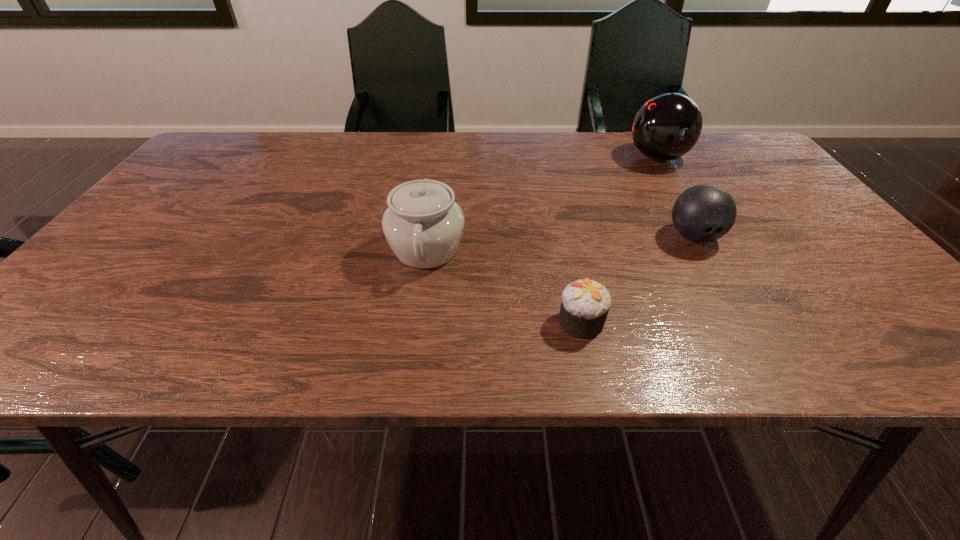
Image resolution: width=960 pixels, height=540 pixels. What are the coordinates of `vacant space in between the chinaware and the third object from right to left` in the screenshot? It's located at (504, 286).

This screenshot has width=960, height=540. What are the coordinates of `the second closest object relative to the chinaware` in the screenshot? It's located at (703, 213).

Identify which object is the second nearest to the third shortest object. Please provide its 2D coordinates. Your answer should be formatted as a tuple, i.e. [(x, y)], where the tuple contains the x and y coordinates of a point satisfying the conditions above.

[(703, 213)]

Where is `vacant space that satisfies the following two spatial constraints: 1. on the surface of the farther bowling ball near the finger holes; 2. on the grip area of the second shortest object`? vacant space that satisfies the following two spatial constraints: 1. on the surface of the farther bowling ball near the finger holes; 2. on the grip area of the second shortest object is located at coordinates (706, 237).

Identify the location of free point that satisfies the following two spatial constraints: 1. on the surface of the farther bowling ball near the finger holes; 2. on the grip area of the nearer bowling ball. (706, 237).

Where is `vacant point that satisfies the following two spatial constraints: 1. on the surface of the taller bowling ball near the finger holes; 2. on the grip area of the third tallest object`? The image size is (960, 540). vacant point that satisfies the following two spatial constraints: 1. on the surface of the taller bowling ball near the finger holes; 2. on the grip area of the third tallest object is located at coordinates (706, 237).